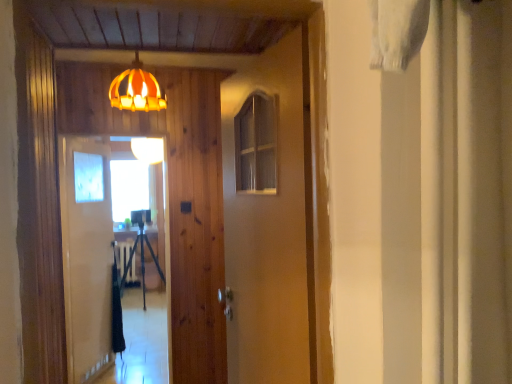
Question: In terms of size, does wooden barn door at center appear bigger or smaller than matte orange lampshade at upper center, which is the first lamp in left-to-right order?

Choices:
 (A) big
 (B) small

Answer: (A)

Question: From a real-world perspective, is wooden barn door at center above or below matte orange lampshade at upper center, which is the first lamp in left-to-right order?

Choices:
 (A) below
 (B) above

Answer: (A)

Question: Considering the real-world distances, which object is farthest from the matte orange lampshade at upper center, placed as the second lamp when sorted from front to back?

Choices:
 (A) wooden barn door at center
 (B) clear glass screen door at center, positioned as the second screen door in front-to-back order
 (C) dark green fabric at center
 (D) matte orange lampshade at upper center, arranged as the first lamp when viewed from the front
 (E) clear glass screen door at center, the second screen door viewed from the back

Answer: (A)

Question: Estimate the real-world distances between objects in this image. Which object is farther from the clear glass screen door at center, the second screen door viewed from the back?

Choices:
 (A) matte orange lampshade at upper center, arranged as the first lamp when viewed from the front
 (B) dark green fabric at center
 (C) matte orange lampshade at upper center, which is the first lamp in left-to-right order
 (D) wooden barn door at center
 (E) clear glass screen door at center, positioned as the second screen door in front-to-back order

Answer: (D)